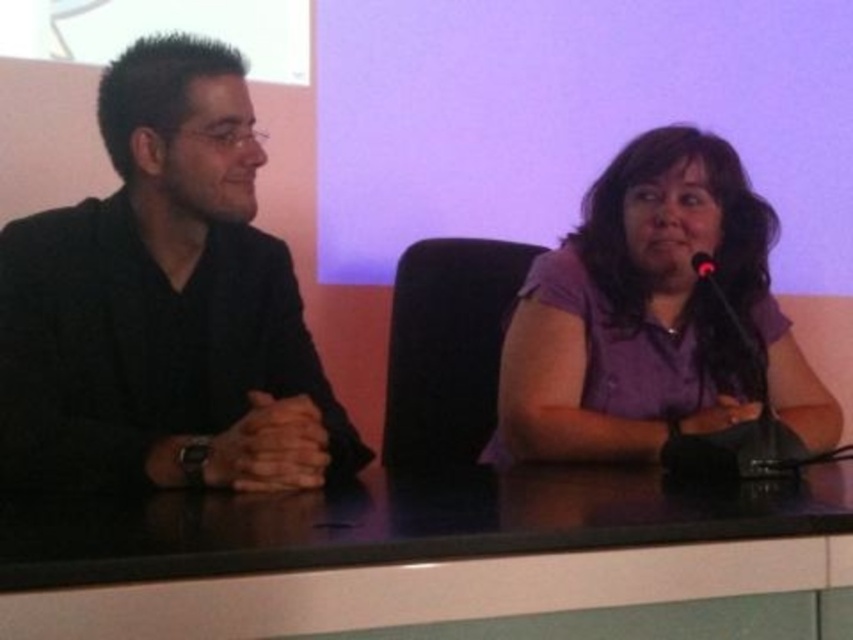
You are an event organizer who needs to ensure that all equipment fits on the table. Given that the purple fabric shirt at right and the black matte microphone at right are both on the table, which object takes up more space?

The purple fabric shirt at right is larger in size than the black matte microphone at right, so it takes up more space on the table.

You are a photographer standing at a distance of 30 inches from the black glossy table at center. You want to take a photo of the table so that it fills the frame without cropping. Is the current distance sufficient?

The black glossy table at center is 27.12 inches away from the camera. Since you are standing 30 inches away, you are slightly farther than the required distance. To fill the frame, you should move 2.88 inches closer to the table.